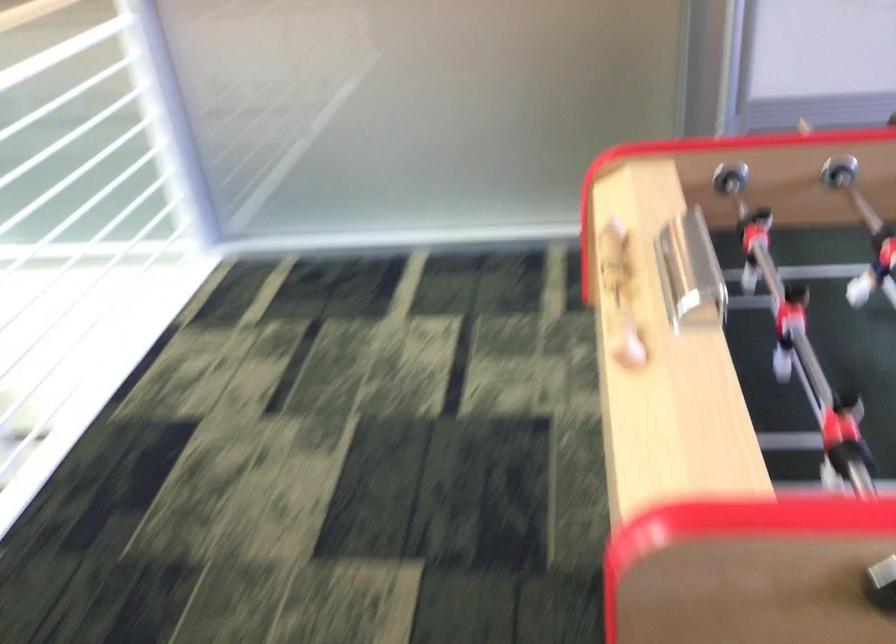
Where would you plac the silver cup holder? Please return your answer as a coordinate pair (x, y).

(690, 272)